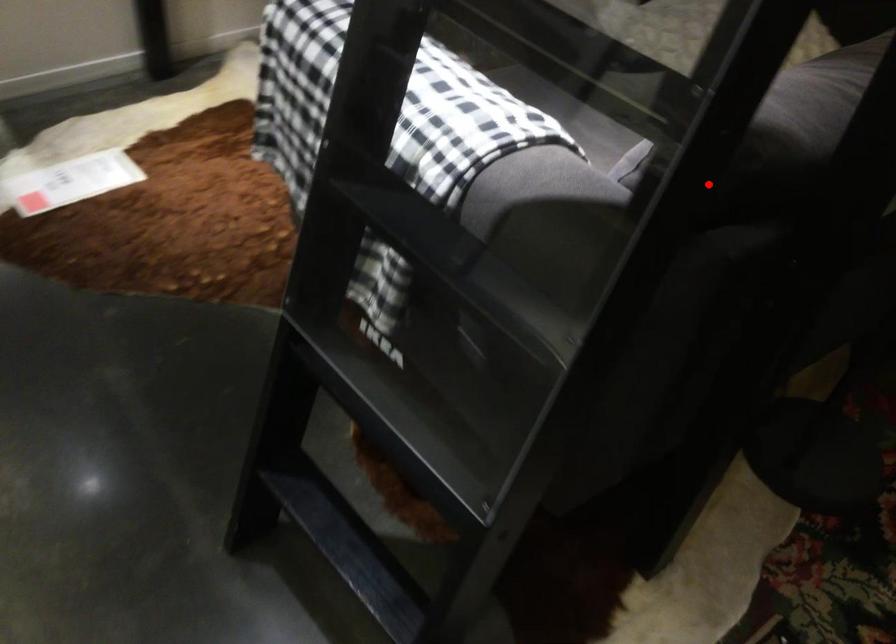
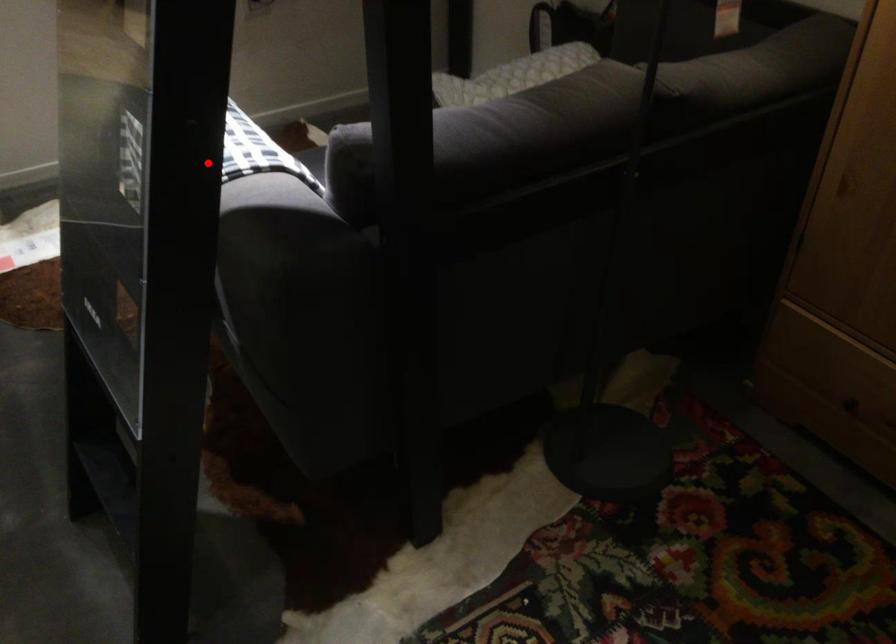
I am providing you with two images of the same scene from different viewpoints. A red point is marked on the first image and another point is marked on the second image. Is the red point in image1 aligned with the point shown in image2?

Yes